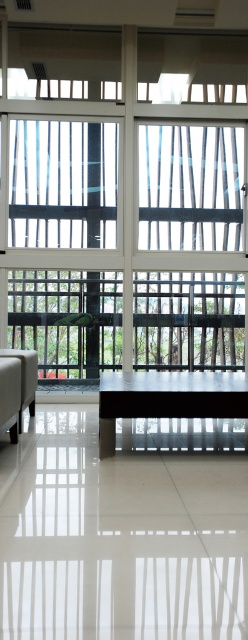
Does transparent glass window at center have a greater height compared to transparent glass window at upper left?

Indeed, transparent glass window at center has a greater height compared to transparent glass window at upper left.

What are the coordinates of `transparent glass window at center` in the screenshot? It's located at (125, 196).

Does point (238, 92) come in front of point (80, 168)?

That is False.

This screenshot has width=248, height=640. I want to click on transparent glass window at center, so click(x=125, y=196).